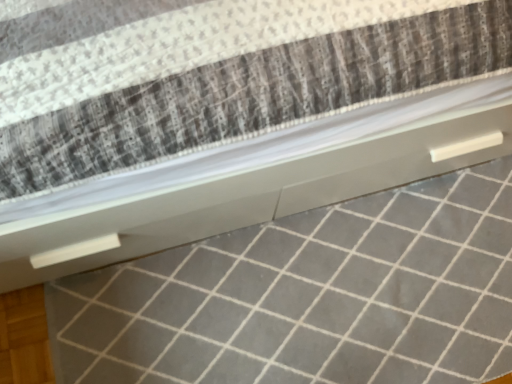
Where is `white textured mattress at center`? The width and height of the screenshot is (512, 384). white textured mattress at center is located at coordinates (220, 75).

The height and width of the screenshot is (384, 512). What do you see at coordinates (220, 75) in the screenshot?
I see `white textured mattress at center` at bounding box center [220, 75].

Where is `white glossy tile at center`? The image size is (512, 384). white glossy tile at center is located at coordinates (310, 296).

Describe the element at coordinates (310, 296) in the screenshot. The image size is (512, 384). I see `white glossy tile at center` at that location.

Locate an element on the screen. Image resolution: width=512 pixels, height=384 pixels. white textured mattress at center is located at coordinates (220, 75).

Considering the positions of objects white glossy tile at center and white textured mattress at center in the image provided, who is more to the right, white glossy tile at center or white textured mattress at center?

Positioned to the right is white glossy tile at center.

Which object is further away from the camera taking this photo, white glossy tile at center or white textured mattress at center?

white glossy tile at center is further away from the camera.

Which is in front, point (124, 329) or point (68, 120)?

The point (68, 120) is closer.

From the image's perspective, which is below, white glossy tile at center or white textured mattress at center?

white glossy tile at center is shown below in the image.

From a real-world perspective, is white glossy tile at center positioned above or below white textured mattress at center?

Clearly, from a real-world perspective, white glossy tile at center is below white textured mattress at center.

Can you confirm if white glossy tile at center is thinner than white textured mattress at center?

Correct, the width of white glossy tile at center is less than that of white textured mattress at center.

Who is taller, white glossy tile at center or white textured mattress at center?

Standing taller between the two is white textured mattress at center.

Based on their sizes in the image, would you say white glossy tile at center is bigger or smaller than white textured mattress at center?

Clearly, white glossy tile at center is smaller in size than white textured mattress at center.

From the picture: Which is correct: white glossy tile at center is inside white textured mattress at center, or outside of it?

white glossy tile at center exists outside the volume of white textured mattress at center.

Is white glossy tile at center far from white textured mattress at center?

white glossy tile at center is near white textured mattress at center, not far away.

Is white glossy tile at center facing away from white textured mattress at center?

white glossy tile at center is not turned away from white textured mattress at center.

This screenshot has width=512, height=384. Identify the location of tile behind the white textured mattress at center. (310, 296).

In the scene shown: Based on their positions, is white textured mattress at center located to the left or right of white glossy tile at center?

From the image, it's evident that white textured mattress at center is to the left of white glossy tile at center.

Considering their positions, is white textured mattress at center located in front of or behind white glossy tile at center?

In the image, white textured mattress at center appears in front of white glossy tile at center.

Which is in front, point (166, 56) or point (418, 317)?

The point (166, 56) is closer to the camera.

From the image's perspective, would you say white textured mattress at center is positioned over white glossy tile at center?

Yes.

From a real-world perspective, is white textured mattress at center beneath white glossy tile at center?

No, from a real-world perspective, white textured mattress at center is not below white glossy tile at center.

In terms of width, does white textured mattress at center look wider or thinner when compared to white glossy tile at center?

white textured mattress at center is wider than white glossy tile at center.

In terms of height, does white textured mattress at center look taller or shorter compared to white glossy tile at center?

In the image, white textured mattress at center appears to be taller than white glossy tile at center.

Between white textured mattress at center and white glossy tile at center, which one has larger size?

With larger size is white textured mattress at center.

Is white textured mattress at center not inside white glossy tile at center?

Yes, white textured mattress at center is located beyond the bounds of white glossy tile at center.

Is white textured mattress at center with white glossy tile at center?

No, white textured mattress at center is not with white glossy tile at center.

Is white textured mattress at center oriented away from white glossy tile at center?

No, white glossy tile at center is not at the back of white textured mattress at center.

What's the angular difference between white textured mattress at center and white glossy tile at center's facing directions?

There is a 1.51-degree angle between the facing directions of white textured mattress at center and white glossy tile at center.

Where is `tile below the white textured mattress at center (from a real-world perspective)`? The width and height of the screenshot is (512, 384). tile below the white textured mattress at center (from a real-world perspective) is located at coordinates (310, 296).

Identify the location of tile located behind the white textured mattress at center. (310, 296).

What are the coordinates of `tile directly beneath the white textured mattress at center (from a real-world perspective)` in the screenshot? It's located at (310, 296).